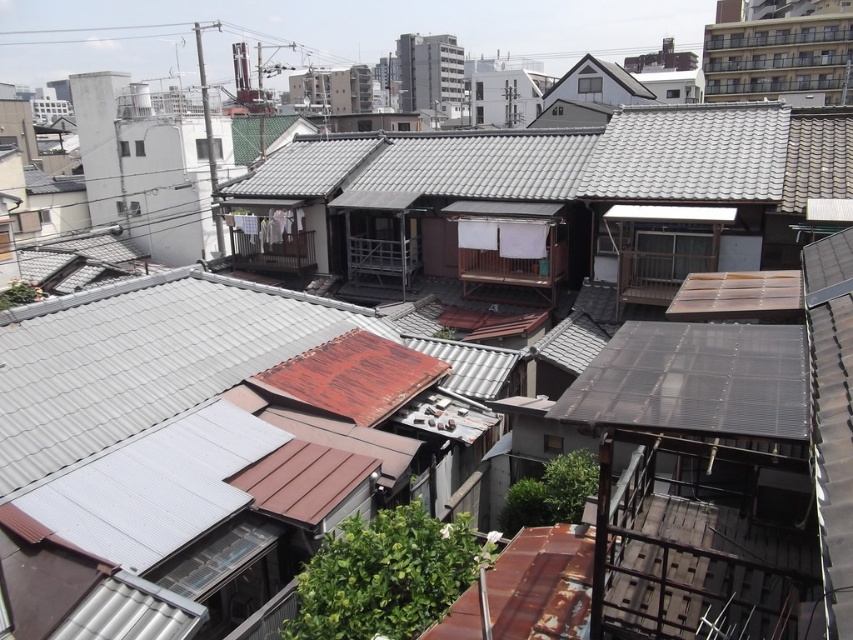
Who is more distant from viewer, (752, 188) or (670, 426)?

Positioned behind is point (752, 188).

Is gray tile roof at center taller than transparent plastic roof at center-right?

Yes, gray tile roof at center is taller than transparent plastic roof at center-right.

Is point (849, 170) farther from viewer compared to point (764, 435)?

Yes, point (849, 170) is behind point (764, 435).

You are a GUI agent. You are given a task and a screenshot of the screen. Output one action in this format:
    pyautogui.click(x=<x>, y=<y>)
    Task: Click on the gray tile roof at center
    The height and width of the screenshot is (640, 853).
    Given the screenshot: What is the action you would take?
    pyautogui.click(x=634, y=157)